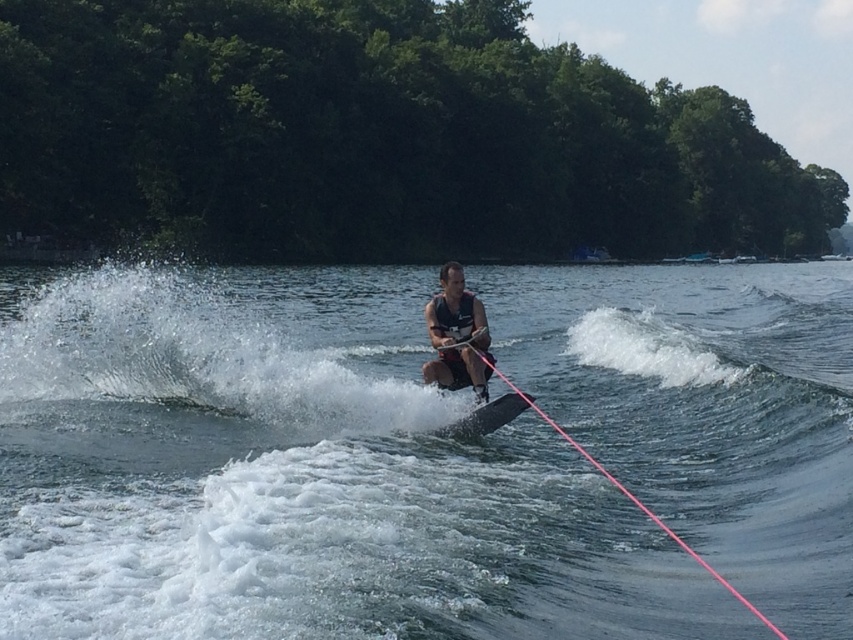
Does green leafy trees at upper center have a larger size compared to pink nylon rope at center?

Yes, green leafy trees at upper center is bigger than pink nylon rope at center.

Which of these two, green leafy trees at upper center or pink nylon rope at center, stands shorter?

With less height is pink nylon rope at center.

Between point (288, 54) and point (598, 461), which one is positioned in front?

Point (598, 461)

Identify the location of green leafy trees at upper center. (372, 138).

Can you confirm if clear water at center is positioned to the right of green leafy trees at upper center?

In fact, clear water at center is to the left of green leafy trees at upper center.

Is point (134, 417) positioned behind point (136, 112)?

No.

Where is `clear water at center`? The image size is (853, 640). clear water at center is located at coordinates (294, 476).

Does matte black life vest at center lie in front of black matte water ski at center?

No, it is behind black matte water ski at center.

Can you confirm if matte black life vest at center is shorter than black matte water ski at center?

No, matte black life vest at center is not shorter than black matte water ski at center.

Identify the location of matte black life vest at center. (456, 336).